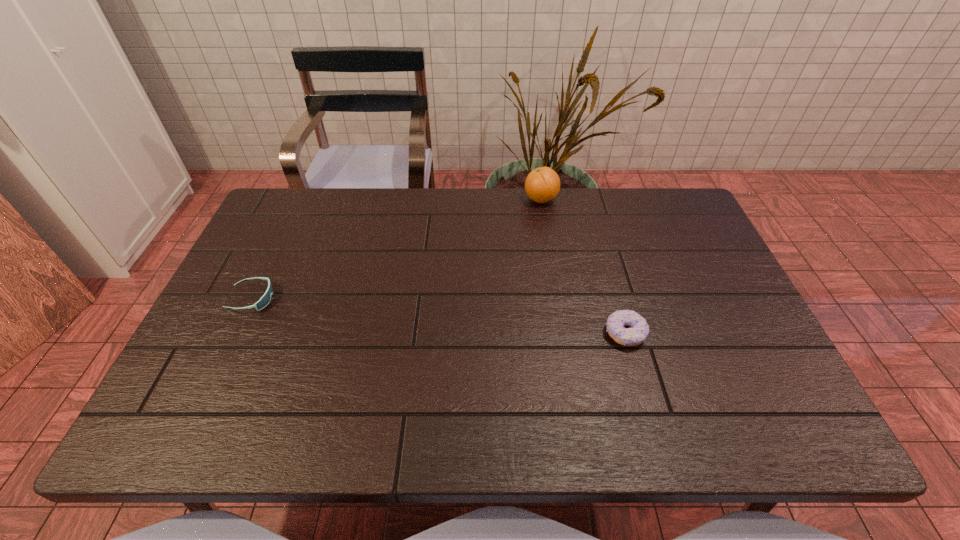
Where is `the farthest object`? Image resolution: width=960 pixels, height=540 pixels. the farthest object is located at coordinates (542, 185).

Find the location of `the tallest object`. the tallest object is located at coordinates (542, 185).

Where is `the rightmost object`? The width and height of the screenshot is (960, 540). the rightmost object is located at coordinates (636, 334).

At what (x,y) coordinates should I click in order to perform the action: click on the second tallest object. Please return your answer as a coordinate pair (x, y). The image size is (960, 540). Looking at the image, I should click on (636, 334).

This screenshot has width=960, height=540. What are the coordinates of `the second nearest object` in the screenshot? It's located at (265, 299).

Identify the location of the leftmost object. Image resolution: width=960 pixels, height=540 pixels. (265, 299).

Find the location of `vacant region located 0.240m on the front of the second object from right to left`. vacant region located 0.240m on the front of the second object from right to left is located at coordinates (551, 262).

Image resolution: width=960 pixels, height=540 pixels. Find the location of `blank space located on the back of the rightmost object`. blank space located on the back of the rightmost object is located at coordinates (606, 267).

Locate an element on the screen. This screenshot has height=540, width=960. vacant region located on the front-facing side of the second nearest object is located at coordinates (321, 299).

I want to click on object situated at the far edge, so click(x=542, y=185).